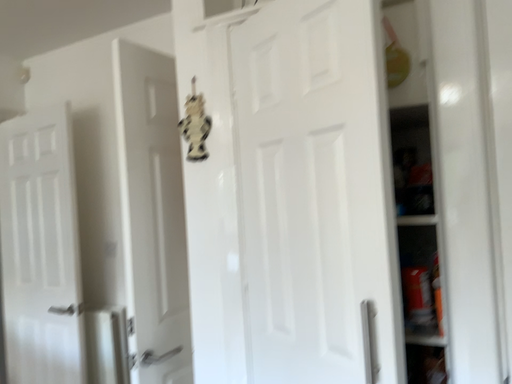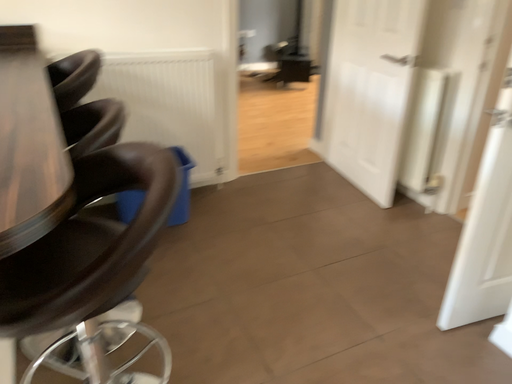
Question: How did the camera likely rotate when shooting the video?

Choices:
 (A) rotated upward
 (B) rotated downward

Answer: (B)